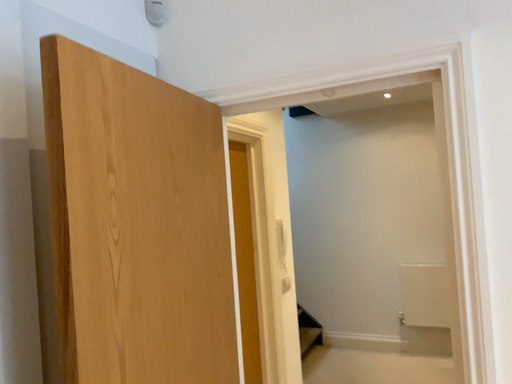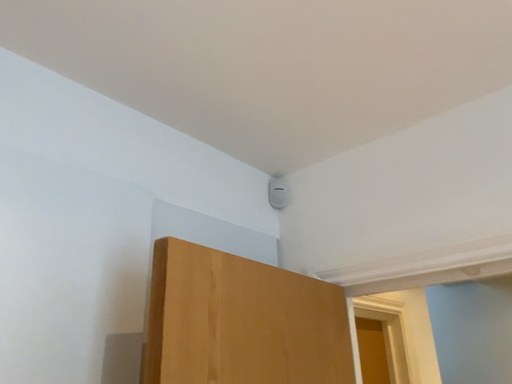
Question: How did the camera likely rotate when shooting the video?

Choices:
 (A) rotated upward
 (B) rotated downward

Answer: (A)